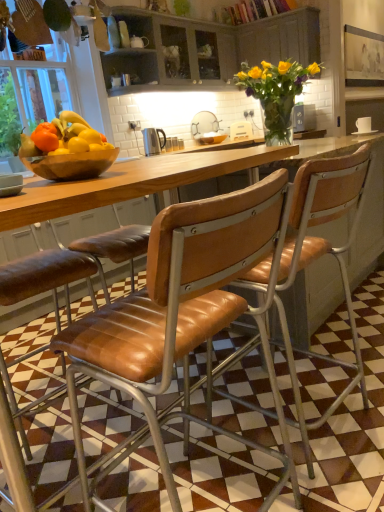
Question: Is point (200, 138) positioned closer to the camera than point (289, 216)?

Choices:
 (A) closer
 (B) farther

Answer: (B)

Question: Would you say matte brown bowl at center, marked as the 1th bowl in a right-to-left arrangement, is to the left or to the right of leather seat at center, acting as the second chair starting from the left, in the picture?

Choices:
 (A) left
 (B) right

Answer: (A)

Question: Which object is positioned farthest from the wooden bowl at left?

Choices:
 (A) matte gray cabinet at upper center, placed as the 2th cabinetry when sorted from right to left
 (B) matte brown bowl at center, the second bowl from the front
 (C) white ceramic sink at center
 (D) satin silver kettle at center
 (E) wooden bowl at center, acting as the second bowl starting from the top

Answer: (E)

Question: Which object is the closest to the leather seat at center, the 1th chair when ordered from right to left?

Choices:
 (A) wooden cabinet at upper center, the 1th cabinetry from the right
 (B) white ceramic sink at center
 (C) wooden bowl at left
 (D) satin silver kettle at center
 (E) brown leather chair at center, the first chair positioned from the left

Answer: (E)